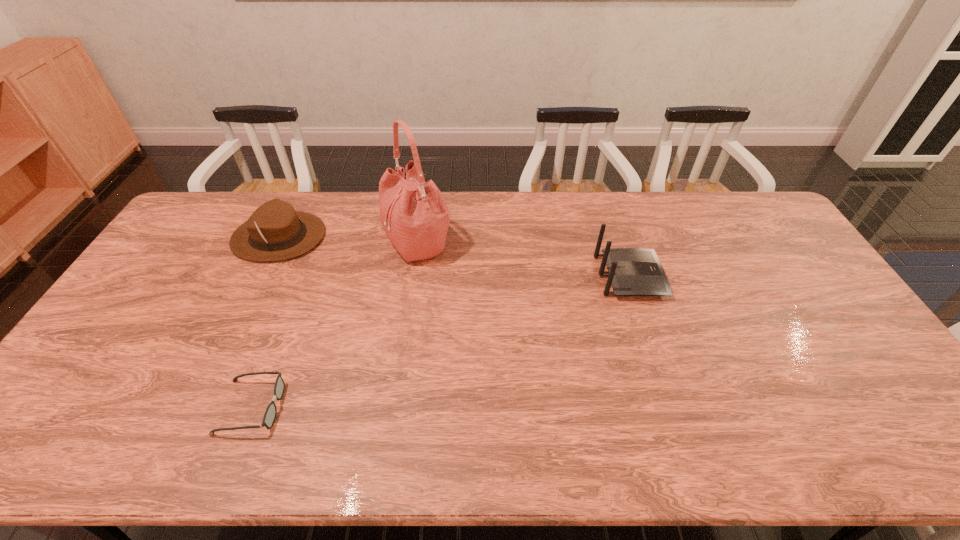
This screenshot has height=540, width=960. Identify the location of free space between the fedora and the router. (454, 257).

Where is `free space between the handbag and the router`? free space between the handbag and the router is located at coordinates (524, 259).

The width and height of the screenshot is (960, 540). Find the location of `vacant space that's between the handbag and the nearest object`. vacant space that's between the handbag and the nearest object is located at coordinates (335, 325).

Locate an element on the screen. The width and height of the screenshot is (960, 540). empty space between the tallest object and the fedora is located at coordinates (348, 240).

In order to click on empty space that is in between the nearest object and the rightmost object in this screenshot , I will do `click(441, 342)`.

The image size is (960, 540). In order to click on empty location between the tallest object and the shortest object in this screenshot , I will do `click(335, 325)`.

The image size is (960, 540). Identify the location of vacant area between the handbag and the spectacles. pyautogui.click(x=335, y=325).

Where is `object identified as the third closest to the second object from right to left`? This screenshot has width=960, height=540. object identified as the third closest to the second object from right to left is located at coordinates (632, 271).

Identify the location of object that is the closest one to the fedora. (414, 215).

At what (x,y) coordinates should I click in order to perform the action: click on vacant region that satisfies the following two spatial constraints: 1. on the front-facing side of the router; 2. on the front side of the third object from left to right. Please return your answer as a coordinate pair (x, y). Looking at the image, I should click on (618, 242).